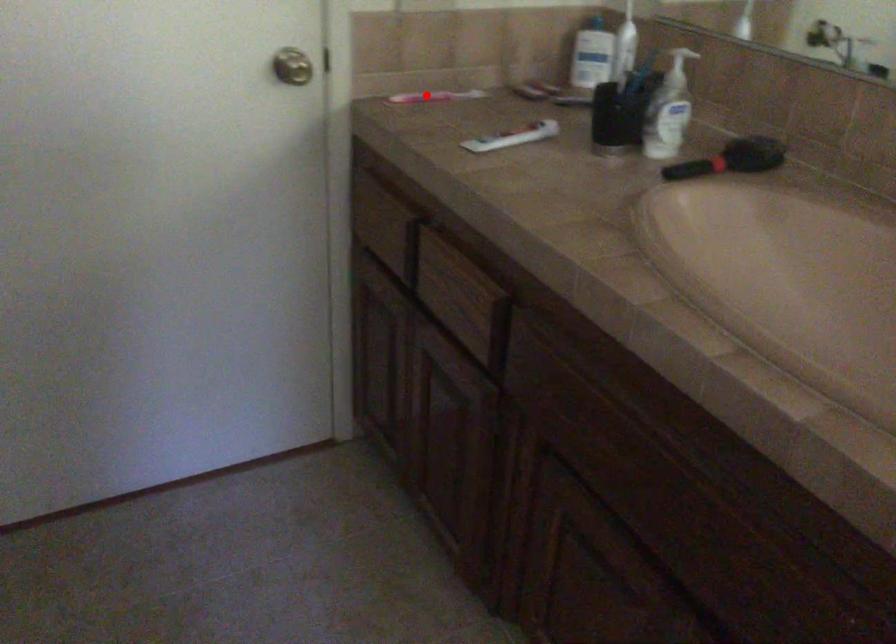
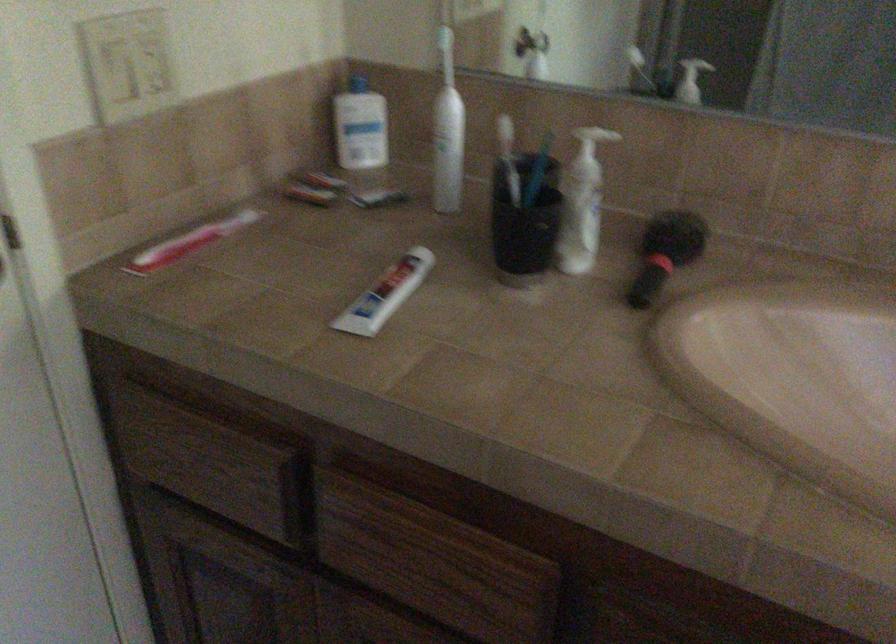
Locate, in the second image, the point that corresponds to the highlighted location in the first image.

(188, 242)